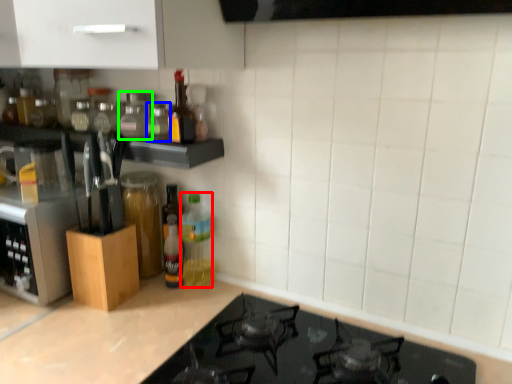
Question: Estimate the real-world distances between objects in this image. Which object is closer to bottle (highlighted by a red box), bottle (highlighted by a blue box) or bottle (highlighted by a green box)?

Choices:
 (A) bottle
 (B) bottle

Answer: (A)